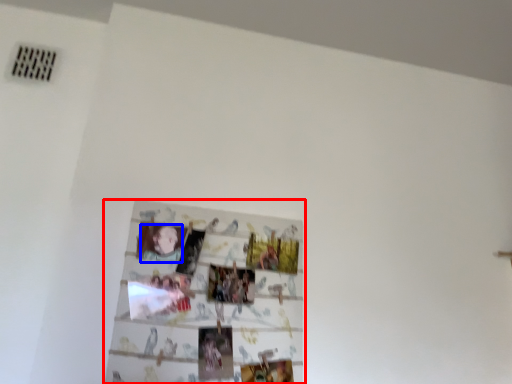
Question: Which object appears closest to the camera in this image, picture frame (highlighted by a red box) or person (highlighted by a blue box)?

Choices:
 (A) picture frame
 (B) person

Answer: (A)